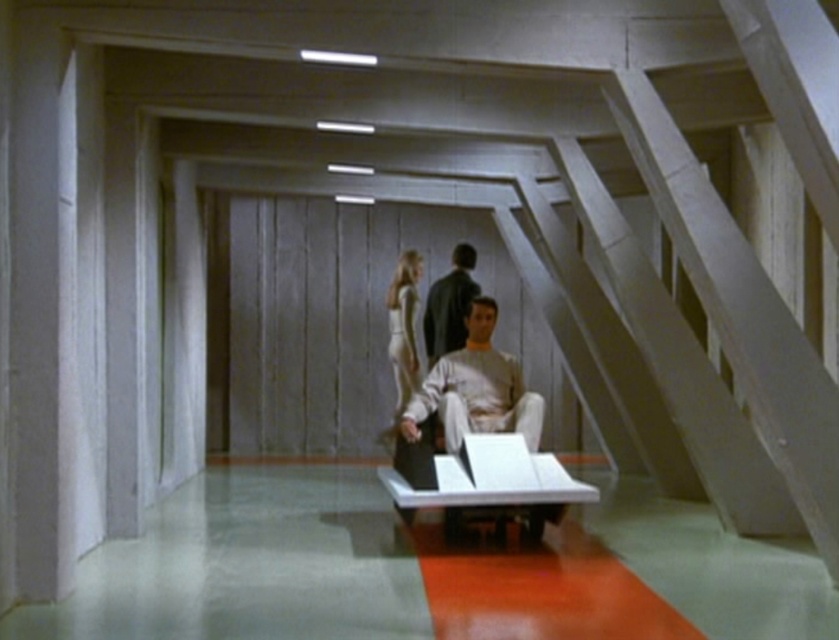
Question: Does light beige fabric shirt at center appear over silvery metallic dress at center?

Choices:
 (A) yes
 (B) no

Answer: (B)

Question: Estimate the real-world distances between objects in this image. Which object is farther from the dark brown leather jacket at center?

Choices:
 (A) silvery metallic dress at center
 (B) light beige fabric shirt at center

Answer: (B)

Question: Does light beige fabric shirt at center appear under dark brown leather jacket at center?

Choices:
 (A) yes
 (B) no

Answer: (A)

Question: Which point appears closest to the camera in this image?

Choices:
 (A) (460, 308)
 (B) (402, 339)

Answer: (A)

Question: Estimate the real-world distances between objects in this image. Which object is farther from the dark brown leather jacket at center?

Choices:
 (A) silvery metallic dress at center
 (B) light beige fabric shirt at center

Answer: (B)

Question: Can you confirm if dark brown leather jacket at center is thinner than silvery metallic dress at center?

Choices:
 (A) yes
 (B) no

Answer: (B)